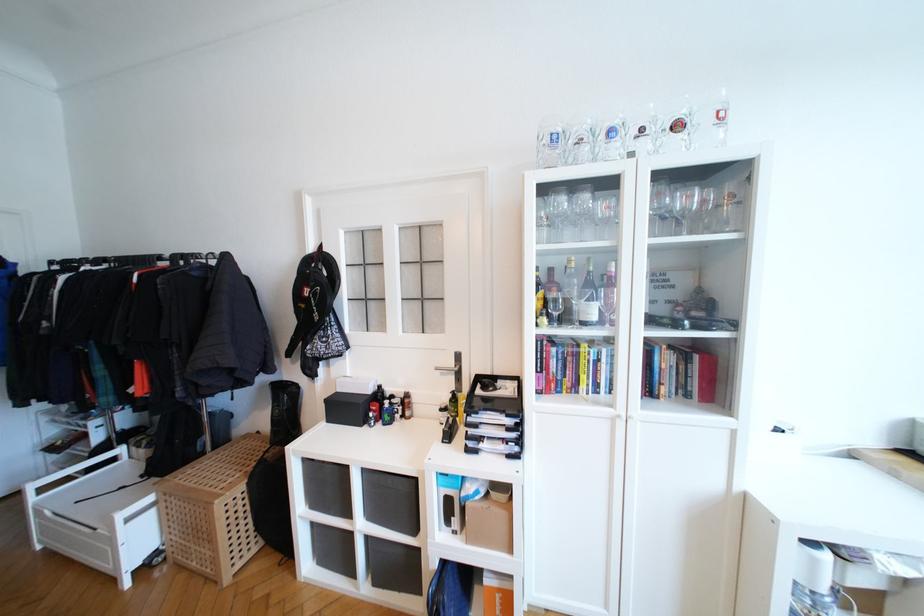
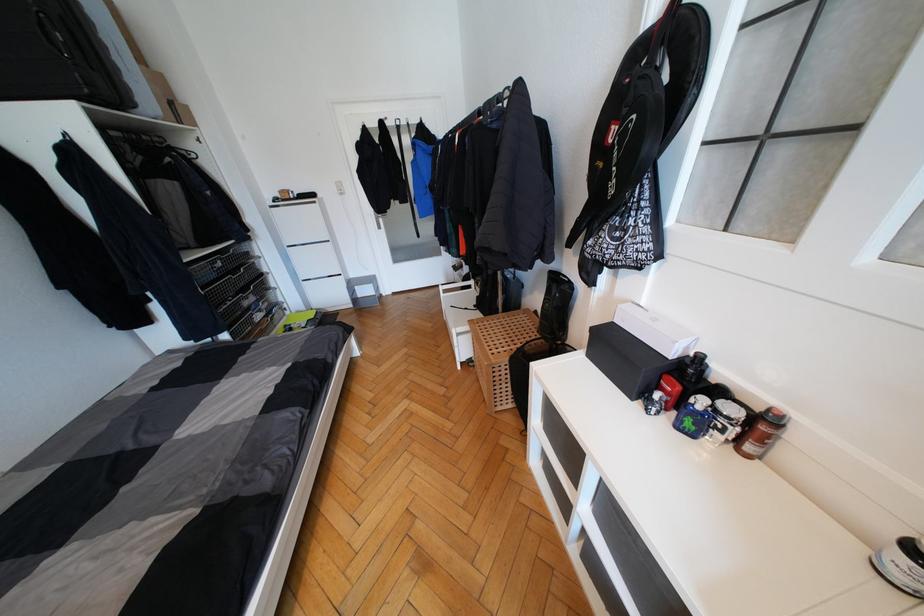
Find the pixel in the second image that matches pixel 324 272 in the first image.

(662, 71)